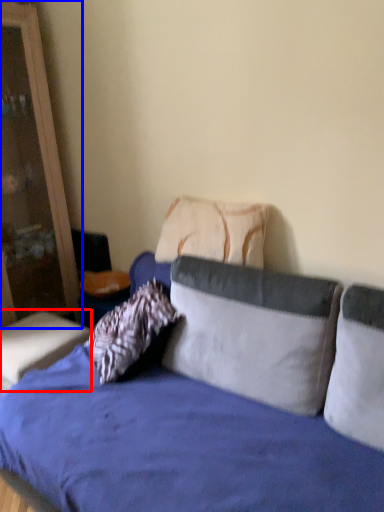
Question: Which of the following is the closest to the observer, table (highlighted by a red box) or dresser (highlighted by a blue box)?

Choices:
 (A) table
 (B) dresser

Answer: (B)